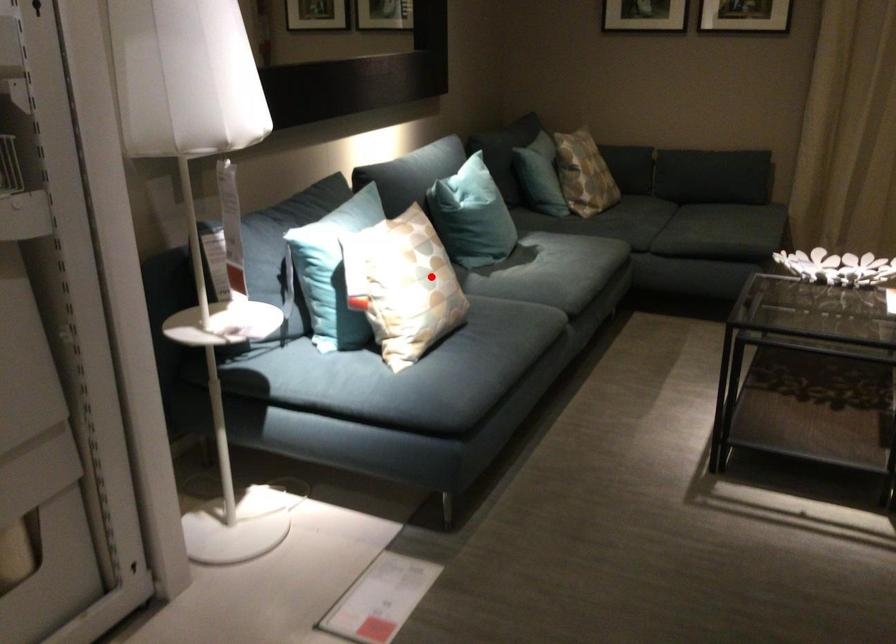
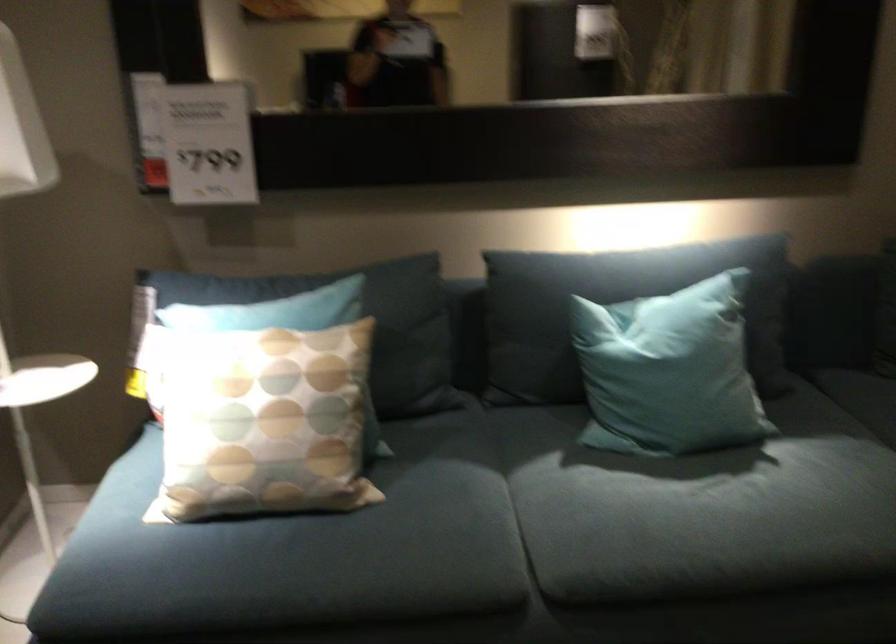
Find the pixel in the second image that matches the highlighted location in the first image.

(263, 422)